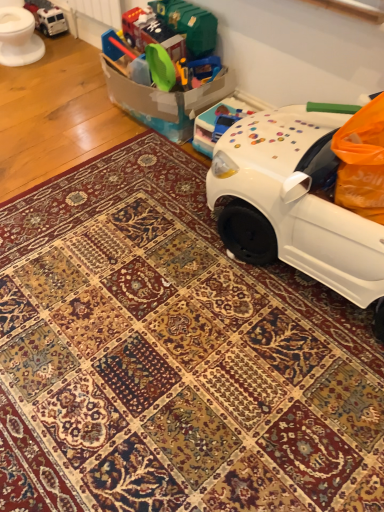
The width and height of the screenshot is (384, 512). I want to click on free space to the left of translucent plastic toy car at upper right, the 2th toy viewed from the back, so click(161, 148).